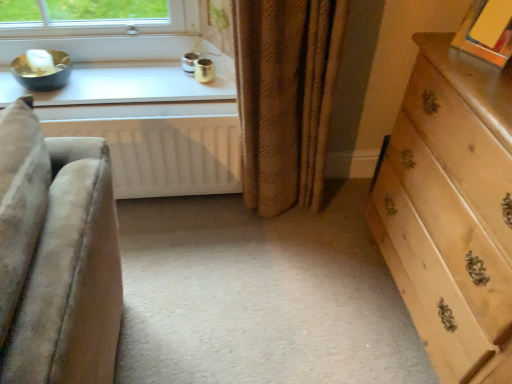
Describe the element at coordinates (451, 210) in the screenshot. I see `light wood dresser at right` at that location.

You are a GUI agent. You are given a task and a screenshot of the screen. Output one action in this format:
    pyautogui.click(x=<x>, y=<y>)
    Task: Click on the light wood dresser at right
    
    Given the screenshot: What is the action you would take?
    pyautogui.click(x=451, y=210)

Does brown textured curtain at center have a greater width compared to light wood dresser at right?

No.

Between brown textured curtain at center and light wood dresser at right, which one has less height?

brown textured curtain at center is shorter.

Is brown textured curtain at center facing away from light wood dresser at right?

No.

From the picture: Are brown textured curtain at center and light wood dresser at right located far from each other?

That's not correct — brown textured curtain at center is a little close to light wood dresser at right.

Is light wood dresser at right inside white glossy window sill at upper left?

No, light wood dresser at right is not surrounded by white glossy window sill at upper left.

From the image's perspective, is white glossy window sill at upper left located beneath light wood dresser at right?

No, from the image's perspective, white glossy window sill at upper left is not beneath light wood dresser at right.

Is white glossy window sill at upper left positioned far away from light wood dresser at right?

white glossy window sill at upper left is actually quite close to light wood dresser at right.

Which object is wider, white glossy window sill at upper left or light wood dresser at right?

light wood dresser at right is wider.

Is white matte radiator at lower center shorter than white glossy window sill at upper left?

No, white matte radiator at lower center is not shorter than white glossy window sill at upper left.

From the image's perspective, which is below, white matte radiator at lower center or white glossy window sill at upper left?

From the image's view, white matte radiator at lower center is below.

Is point (206, 116) farther from camera compared to point (170, 71)?

That is False.

Which of these two, white matte radiator at lower center or white glossy window sill at upper left, is smaller?

With smaller size is white glossy window sill at upper left.

Looking at their sizes, would you say brown textured curtain at center is wider or thinner than white matte radiator at lower center?

Considering their sizes, brown textured curtain at center looks broader than white matte radiator at lower center.

Considering the positions of point (264, 199) and point (200, 131), is point (264, 199) closer or farther from the camera than point (200, 131)?

Point (264, 199) is positioned farther from the camera compared to point (200, 131).

Is brown textured curtain at center in front of white matte radiator at lower center?

Yes.

From a real-world perspective, who is located lower, brown textured curtain at center or white glossy window sill at upper left?

In real-world perspective, brown textured curtain at center is lower.

Does point (257, 138) come behind point (161, 97)?

No, it is in front of (161, 97).

Considering the sizes of brown textured curtain at center and white glossy window sill at upper left in the image, is brown textured curtain at center wider or thinner than white glossy window sill at upper left?

Clearly, brown textured curtain at center has more width compared to white glossy window sill at upper left.

From a real-world perspective, between light wood dresser at right and brown textured curtain at center, who is vertically lower?

brown textured curtain at center, from a real-world perspective.

Can you confirm if light wood dresser at right is thinner than brown textured curtain at center?

No, light wood dresser at right is not thinner than brown textured curtain at center.

Is light wood dresser at right completely or partially outside of brown textured curtain at center?

Yes, light wood dresser at right is outside of brown textured curtain at center.

Can you tell me how much light wood dresser at right and brown textured curtain at center differ in facing direction?

The facing directions of light wood dresser at right and brown textured curtain at center are 85.9 degrees apart.

Looking at this image, in terms of height, does white matte radiator at lower center look taller or shorter compared to light wood dresser at right?

Considering their sizes, white matte radiator at lower center has less height than light wood dresser at right.

Looking at this image, from the image's perspective, would you say white matte radiator at lower center is positioned over light wood dresser at right?

Yes, from the image's perspective, white matte radiator at lower center is above light wood dresser at right.

Considering their positions, is white matte radiator at lower center located in front of or behind light wood dresser at right?

Visually, white matte radiator at lower center is located behind light wood dresser at right.

Visually, is white matte radiator at lower center positioned to the left or to the right of light wood dresser at right?

white matte radiator at lower center is to the left of light wood dresser at right.

The image size is (512, 384). Identify the location of curtain below the light wood dresser at right (from a real-world perspective). (286, 97).

Identify the location of window sill that appears behind the light wood dresser at right. (122, 86).

Consider the image. Considering their positions, is brown textured curtain at center positioned closer to white matte radiator at lower center than white glossy window sill at upper left?

white glossy window sill at upper left lies closer to white matte radiator at lower center than the other object.

Looking at this image, from the image, which object appears to be nearer to brown textured curtain at center, white matte radiator at lower center or white glossy window sill at upper left?

white matte radiator at lower center.

When comparing their distances from white matte radiator at lower center, does brown textured curtain at center or light wood dresser at right seem further?

Among the two, light wood dresser at right is located further to white matte radiator at lower center.

Based on their spatial positions, is light wood dresser at right or white matte radiator at lower center closer to white glossy window sill at upper left?

white matte radiator at lower center is closer to white glossy window sill at upper left.

When comparing their distances from light wood dresser at right, does white glossy window sill at upper left or brown textured curtain at center seem closer?

brown textured curtain at center is closer to light wood dresser at right.

Based on their spatial positions, is white matte radiator at lower center or white glossy window sill at upper left further from light wood dresser at right?

The object further to light wood dresser at right is white glossy window sill at upper left.

Based on their spatial positions, is light wood dresser at right or white glossy window sill at upper left closer to white matte radiator at lower center?

white glossy window sill at upper left is closer to white matte radiator at lower center.

Which object lies further to the anchor point white glossy window sill at upper left, white matte radiator at lower center or light wood dresser at right?

The object further to white glossy window sill at upper left is light wood dresser at right.

Identify the location of radiator situated between white glossy window sill at upper left and brown textured curtain at center from left to right. (165, 153).

What are the coordinates of `curtain between white matte radiator at lower center and light wood dresser at right from left to right` in the screenshot? It's located at (286, 97).

Identify the location of radiator between white glossy window sill at upper left and light wood dresser at right. (165, 153).

Locate an element on the screen. The height and width of the screenshot is (384, 512). curtain situated between white glossy window sill at upper left and light wood dresser at right from left to right is located at coordinates (286, 97).